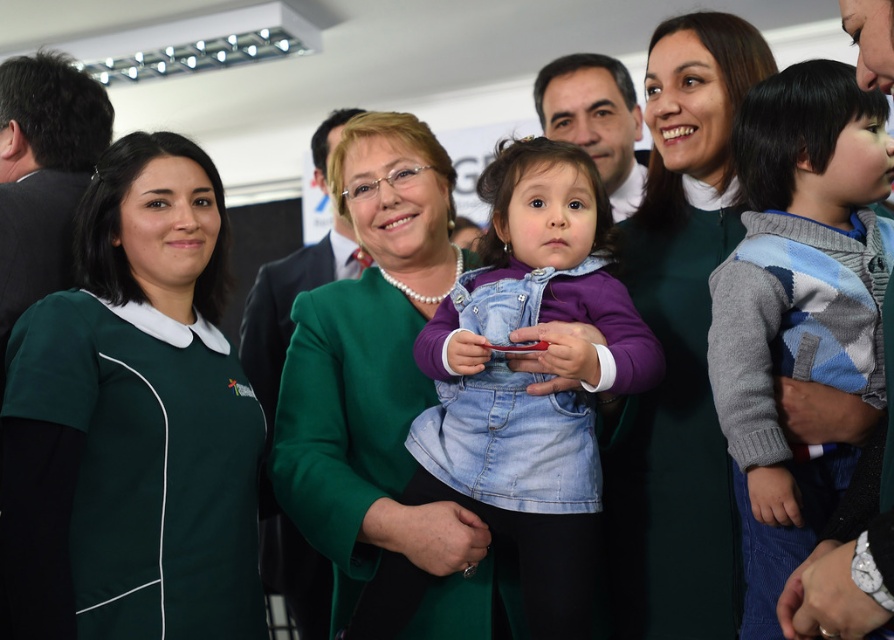
Does point (772, 218) come in front of point (346, 573)?

Yes, point (772, 218) is in front of point (346, 573).

Between point (781, 483) and point (477, 592), which one is positioned in front?

Positioned in front is point (781, 483).

At what (x,y) coordinates should I click in order to perform the action: click on argyle sweater at center. Please return your answer as a coordinate pair (x, y). This screenshot has height=640, width=894. Looking at the image, I should click on (797, 305).

Does green fabric shirt at left appear under green dress at center?

Correct, green fabric shirt at left is located below green dress at center.

Consider the image. Measure the distance between point (196,346) and camera.

Point (196,346) and camera are 4.92 feet apart.

Identify the location of green fabric shirt at left. The image size is (894, 640). (133, 420).

Between green fabric shirt at left and argyle sweater at center, which one appears on the left side from the viewer's perspective?

green fabric shirt at left

Between green fabric shirt at left and argyle sweater at center, which one appears on the right side from the viewer's perspective?

From the viewer's perspective, argyle sweater at center appears more on the right side.

Which is behind, point (86, 582) or point (831, 83)?

Positioned behind is point (831, 83).

Locate an element on the screen. green fabric shirt at left is located at coordinates (133, 420).